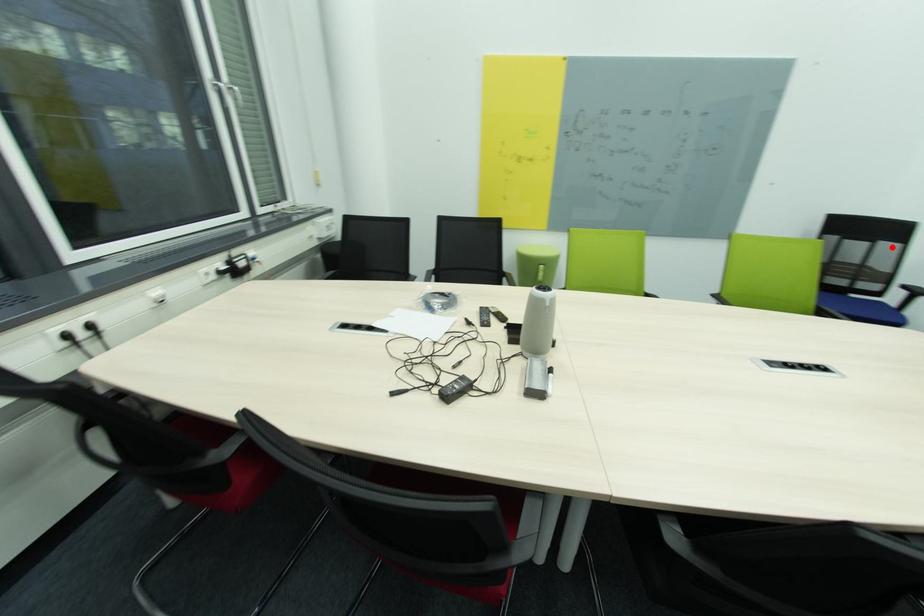
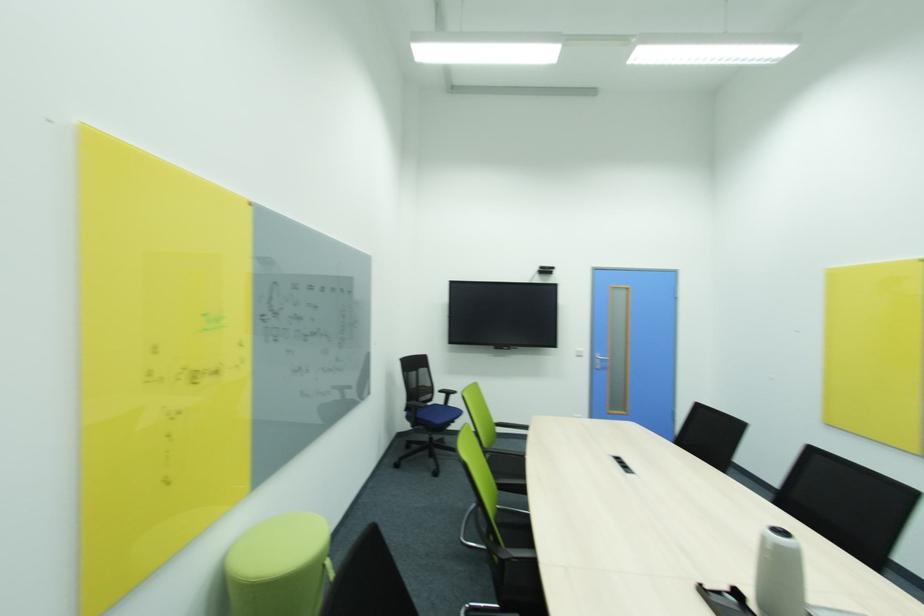
Find the pixel in the second image that matches the highlighted location in the first image.

(428, 371)